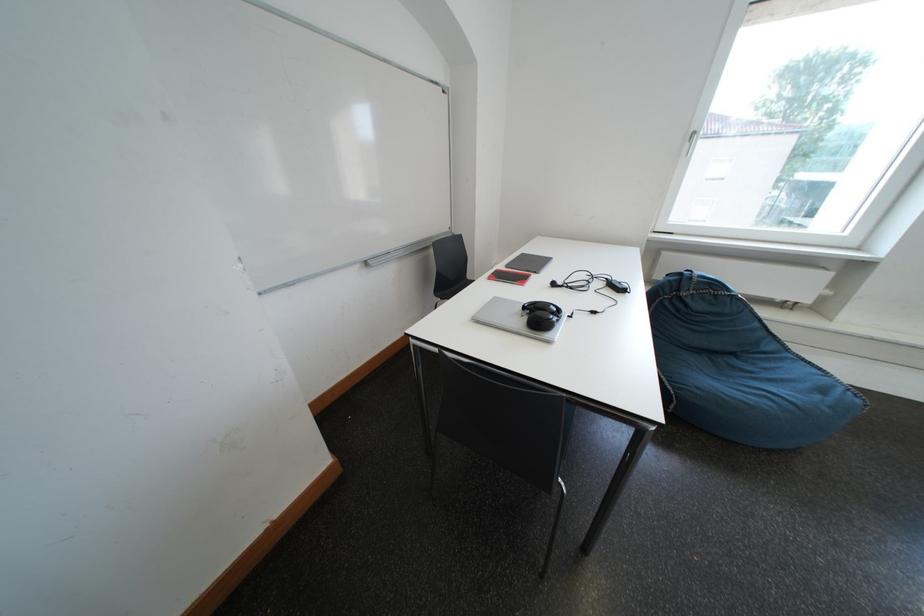
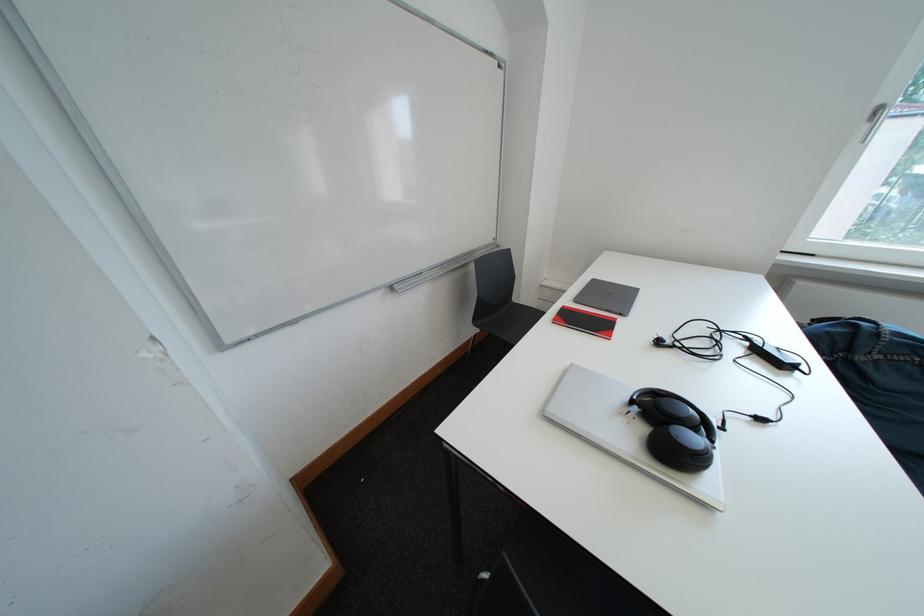
Question: In a continuous first-person perspective shot, in which direction is the camera moving?

Choices:
 (A) Left
 (B) Right
 (C) Forward
 (D) Backward

Answer: (C)